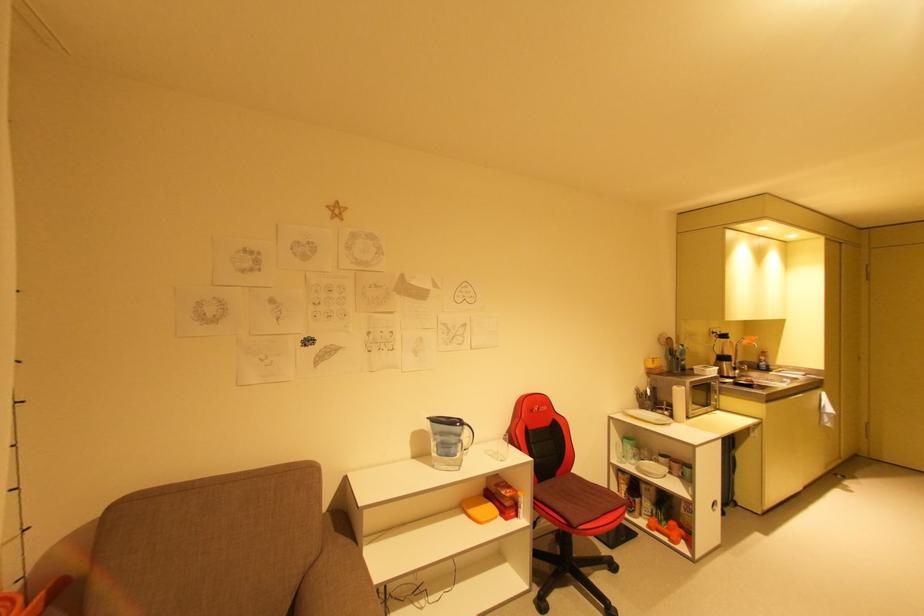
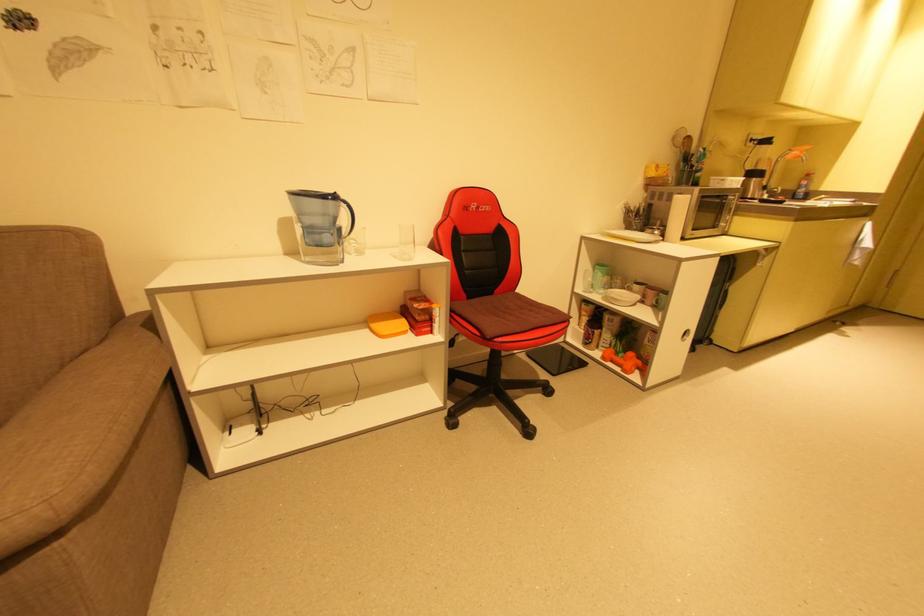
The point at (469,427) is marked in the first image. Where is the corresponding point in the second image?

(346, 204)